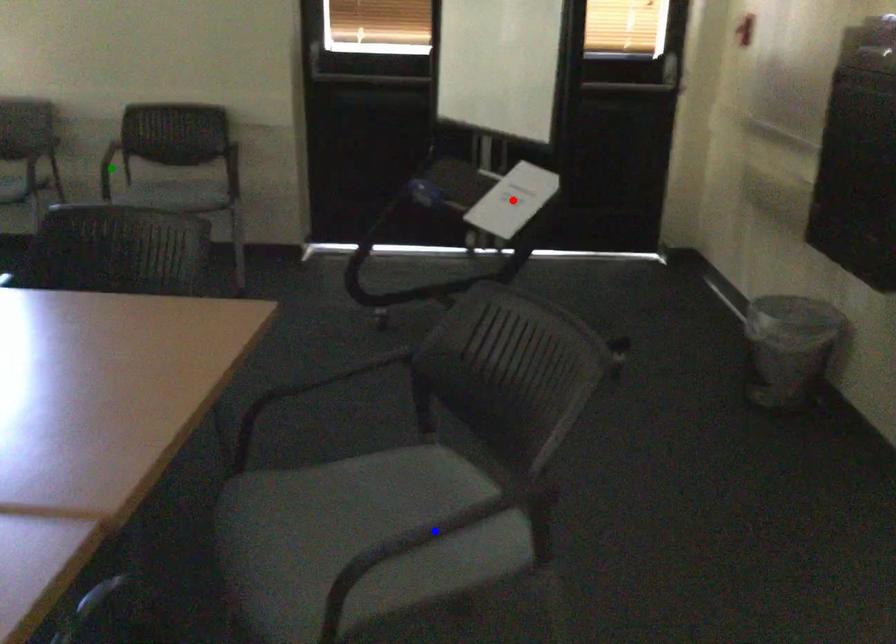
From the picture: Order these from nearest to farthest:
blue point, red point, green point

green point, red point, blue point